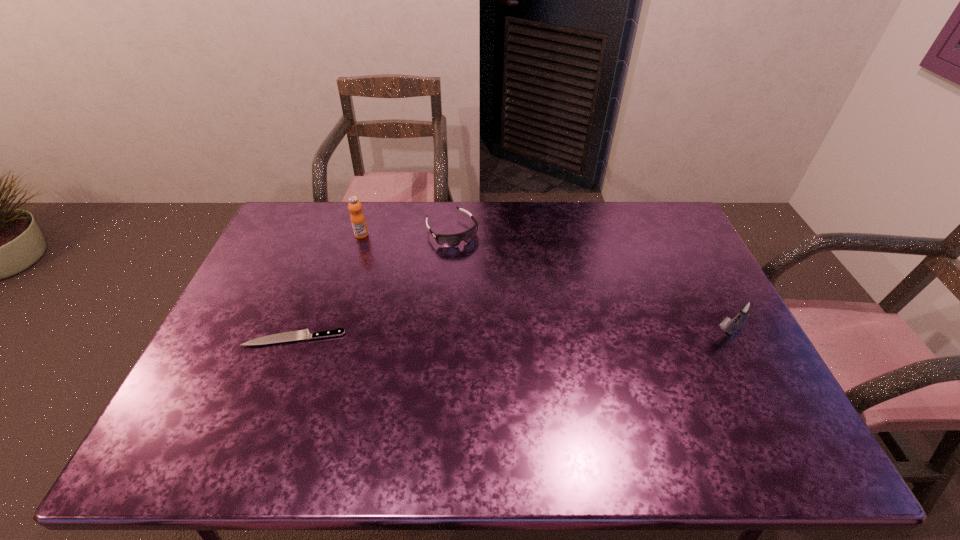
The width and height of the screenshot is (960, 540). I want to click on blank space at the left edge of the desktop, so click(276, 273).

The height and width of the screenshot is (540, 960). In order to click on vacant space at the right edge of the desktop in this screenshot , I will do `click(716, 341)`.

Find the location of a particular element. The image size is (960, 540). free region at the far left corner is located at coordinates (290, 205).

Locate an element on the screen. The width and height of the screenshot is (960, 540). vacant space at the near left corner of the desktop is located at coordinates pyautogui.click(x=199, y=399).

You are a GUI agent. You are given a task and a screenshot of the screen. Output one action in this format:
    pyautogui.click(x=<x>, y=<y>)
    Task: Click on the free space between the orange juice and the igniter
    The width and height of the screenshot is (960, 540).
    Given the screenshot: What is the action you would take?
    pyautogui.click(x=544, y=285)

I want to click on vacant area that lies between the third object from left to right and the tallest object, so click(x=407, y=233).

Locate an element on the screen. The height and width of the screenshot is (540, 960). free point between the shortest object and the igniter is located at coordinates (511, 336).

The image size is (960, 540). What are the coordinates of `vacant area that lies between the second object from right to left and the steak knife` in the screenshot? It's located at (373, 285).

I want to click on unoccupied position between the orange juice and the igniter, so click(x=544, y=285).

Where is `free spot between the shortest object and the orange juice`? free spot between the shortest object and the orange juice is located at coordinates (328, 286).